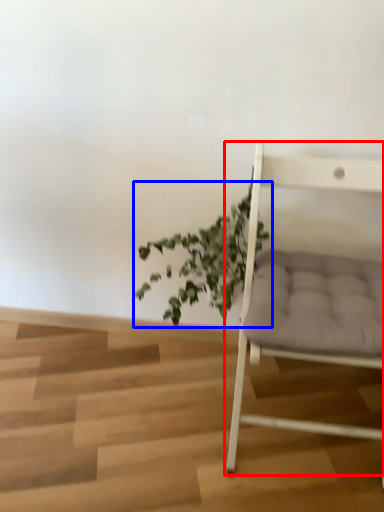
Question: Among these objects, which one is farthest to the camera, chair (highlighted by a red box) or houseplant (highlighted by a blue box)?

Choices:
 (A) chair
 (B) houseplant

Answer: (B)